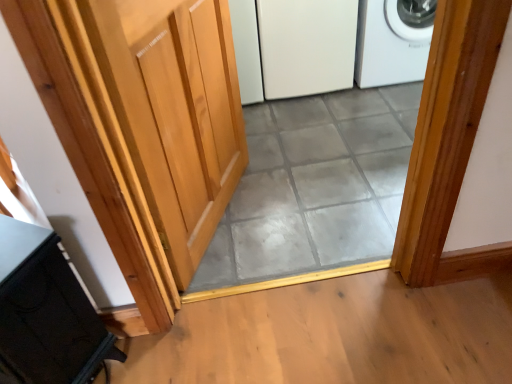
Question: Is the depth of gray tile at center less than that of light wood door at center?

Choices:
 (A) yes
 (B) no

Answer: (B)

Question: Does gray tile at center have a greater height compared to light wood door at center?

Choices:
 (A) no
 (B) yes

Answer: (A)

Question: Is gray tile at center next to light wood door at center and touching it?

Choices:
 (A) yes
 (B) no

Answer: (B)

Question: Does gray tile at center have a lesser height compared to light wood door at center?

Choices:
 (A) yes
 (B) no

Answer: (A)

Question: Is gray tile at center smaller than light wood door at center?

Choices:
 (A) yes
 (B) no

Answer: (A)

Question: Does gray tile at center contain light wood door at center?

Choices:
 (A) yes
 (B) no

Answer: (B)

Question: Is white matte refrigerator at center at the back of gray tile at center?

Choices:
 (A) no
 (B) yes

Answer: (A)

Question: Is gray tile at center closer to camera compared to white matte refrigerator at center?

Choices:
 (A) no
 (B) yes

Answer: (B)

Question: Considering the relative sizes of gray tile at center and white matte refrigerator at center in the image provided, is gray tile at center taller than white matte refrigerator at center?

Choices:
 (A) yes
 (B) no

Answer: (B)

Question: From the image's perspective, does gray tile at center appear lower than white matte refrigerator at center?

Choices:
 (A) yes
 (B) no

Answer: (A)

Question: Does gray tile at center appear on the right side of white matte refrigerator at center?

Choices:
 (A) yes
 (B) no

Answer: (A)

Question: Is gray tile at center to the left of white matte refrigerator at center from the viewer's perspective?

Choices:
 (A) yes
 (B) no

Answer: (B)

Question: Does gray tile at center appear on the left side of black matte cabinet at lower left?

Choices:
 (A) yes
 (B) no

Answer: (B)